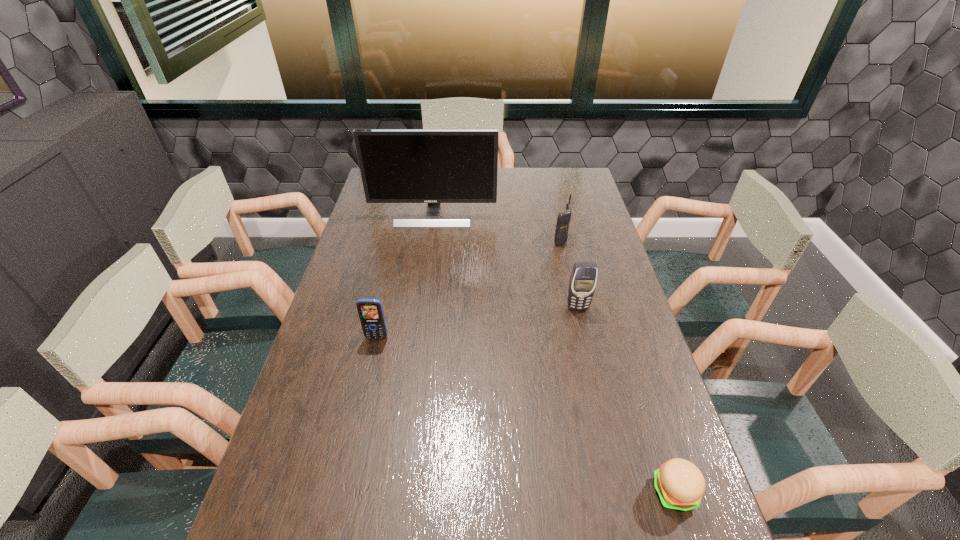
Identify the location of monitor. (434, 166).

In order to click on the tallest object in this screenshot , I will do `click(434, 166)`.

Locate an element on the screen. This screenshot has height=540, width=960. the second farthest cellular telephone is located at coordinates (583, 279).

At what (x,y) coordinates should I click in order to perform the action: click on the fourth nearest object. Please return your answer as a coordinate pair (x, y). Looking at the image, I should click on (563, 220).

The image size is (960, 540). What are the coordinates of `the nearest cellular telephone` in the screenshot? It's located at (370, 311).

Where is `the leftmost cellular telephone`? the leftmost cellular telephone is located at coordinates (370, 311).

This screenshot has width=960, height=540. I want to click on the rightmost object, so click(680, 485).

I want to click on hamburger, so [680, 485].

Where is `free space located 0.400m on the screen side of the tallest object`? free space located 0.400m on the screen side of the tallest object is located at coordinates (421, 302).

Where is `free point located 0.100m on the front face of the third nearest object`? free point located 0.100m on the front face of the third nearest object is located at coordinates (585, 337).